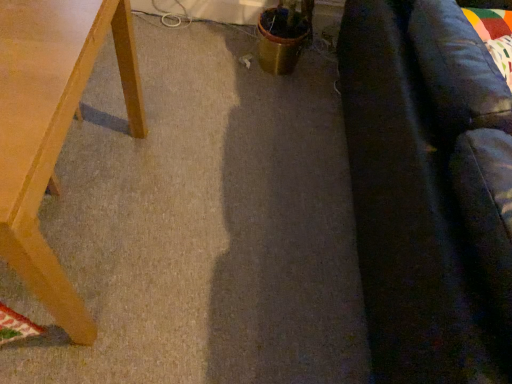
The image size is (512, 384). What do you see at coordinates (429, 191) in the screenshot? I see `dark gray fabric couch at right` at bounding box center [429, 191].

Image resolution: width=512 pixels, height=384 pixels. Identify the location of dark gray fabric couch at right. (429, 191).

What do you see at coordinates (51, 127) in the screenshot? I see `light brown wooden table at left` at bounding box center [51, 127].

Locate an element on the screen. The height and width of the screenshot is (384, 512). light brown wooden table at left is located at coordinates (51, 127).

Find the location of a particular element. This screenshot has height=384, width=512. dark gray fabric couch at right is located at coordinates (429, 191).

Considering the relative positions of dark gray fabric couch at right and light brown wooden table at left in the image provided, is dark gray fabric couch at right to the right of light brown wooden table at left from the viewer's perspective?

Yes, dark gray fabric couch at right is to the right of light brown wooden table at left.

Considering the positions of objects dark gray fabric couch at right and light brown wooden table at left in the image provided, who is behind, dark gray fabric couch at right or light brown wooden table at left?

light brown wooden table at left.

Considering the points (506, 187) and (39, 185), which point is in front, point (506, 187) or point (39, 185)?

The point (506, 187) is closer.

From the image's perspective, is dark gray fabric couch at right beneath light brown wooden table at left?

Actually, dark gray fabric couch at right appears above light brown wooden table at left in the image.

From a real-world perspective, who is located higher, dark gray fabric couch at right or light brown wooden table at left?

In real-world perspective, dark gray fabric couch at right is above.

Which of these two, dark gray fabric couch at right or light brown wooden table at left, is wider?

dark gray fabric couch at right is wider.

Between dark gray fabric couch at right and light brown wooden table at left, which one has less height?

light brown wooden table at left is shorter.

Between dark gray fabric couch at right and light brown wooden table at left, which one has smaller size?

With smaller size is light brown wooden table at left.

Is dark gray fabric couch at right located outside light brown wooden table at left?

Absolutely, dark gray fabric couch at right is external to light brown wooden table at left.

Is dark gray fabric couch at right positioned far away from light brown wooden table at left?

They are positioned close to each other.

Is dark gray fabric couch at right facing towards light brown wooden table at left?

No.

What's the angular difference between dark gray fabric couch at right and light brown wooden table at left's facing directions?

0.731 degrees.

This screenshot has height=384, width=512. Identify the location of couch that is above the light brown wooden table at left (from a real-world perspective). (429, 191).

Visually, is light brown wooden table at left positioned to the left or to the right of dark gray fabric couch at right?

In the image, light brown wooden table at left appears on the left side of dark gray fabric couch at right.

In the scene shown: Relative to dark gray fabric couch at right, is light brown wooden table at left in front or behind?

light brown wooden table at left is behind dark gray fabric couch at right.

Is point (7, 111) farther from viewer compared to point (404, 359)?

No, (7, 111) is closer to viewer.

From the image's perspective, which is below, light brown wooden table at left or dark gray fabric couch at right?

light brown wooden table at left, from the image's perspective.

From a real-world perspective, which object stands above the other?

From a 3D spatial view, dark gray fabric couch at right is above.

Between light brown wooden table at left and dark gray fabric couch at right, which one has larger width?

With larger width is dark gray fabric couch at right.

Considering the sizes of objects light brown wooden table at left and dark gray fabric couch at right in the image provided, who is shorter, light brown wooden table at left or dark gray fabric couch at right?

light brown wooden table at left is shorter.

Considering the relative sizes of light brown wooden table at left and dark gray fabric couch at right in the image provided, is light brown wooden table at left smaller than dark gray fabric couch at right?

Yes.

Looking at this image, does light brown wooden table at left contain dark gray fabric couch at right?

That's incorrect, dark gray fabric couch at right is not inside light brown wooden table at left.

Are light brown wooden table at left and dark gray fabric couch at right located far from each other?

light brown wooden table at left is actually quite close to dark gray fabric couch at right.

Is light brown wooden table at left positioned with its back to dark gray fabric couch at right?

No, light brown wooden table at left is not facing away from dark gray fabric couch at right.

How different are the orientations of light brown wooden table at left and dark gray fabric couch at right in degrees?

The facing directions of light brown wooden table at left and dark gray fabric couch at right are 0.731 degrees apart.

Where is `couch lying on the right of light brown wooden table at left`? The width and height of the screenshot is (512, 384). couch lying on the right of light brown wooden table at left is located at coordinates (429, 191).

This screenshot has width=512, height=384. I want to click on table on the left of dark gray fabric couch at right, so click(51, 127).

This screenshot has height=384, width=512. What are the coordinates of `table behind the dark gray fabric couch at right` in the screenshot? It's located at (51, 127).